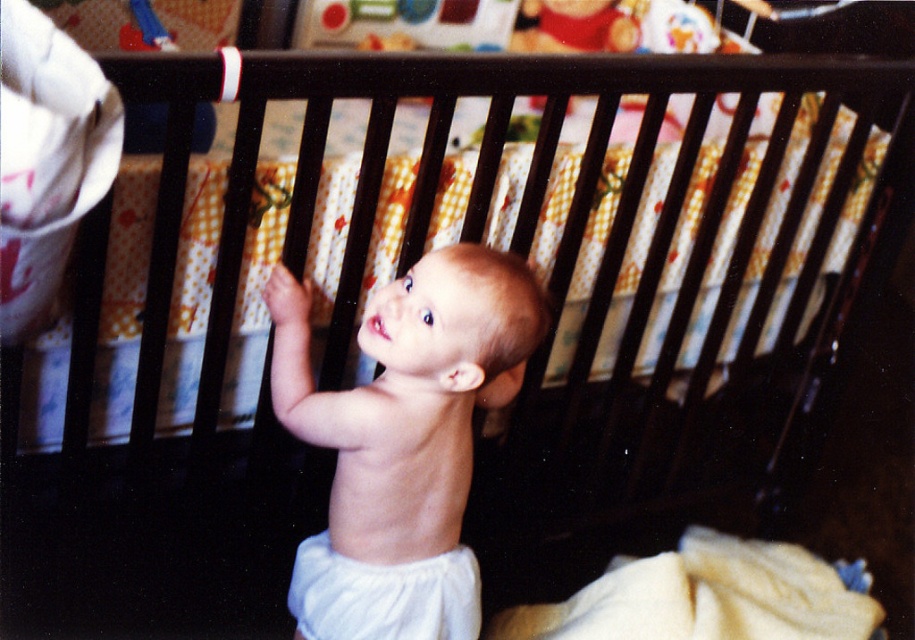
Question: Which point appears closest to the camera in this image?

Choices:
 (A) (416, 580)
 (B) (300, 627)

Answer: (A)

Question: Does smooth white diaper at center appear on the right side of white cloth diaper at center?

Choices:
 (A) no
 (B) yes

Answer: (B)

Question: Can you confirm if smooth white diaper at center is positioned below white cloth diaper at center?

Choices:
 (A) yes
 (B) no

Answer: (B)

Question: Which point is farther from the camera taking this photo?

Choices:
 (A) (354, 609)
 (B) (501, 397)

Answer: (B)

Question: Is smooth white diaper at center to the left of white cloth diaper at center from the viewer's perspective?

Choices:
 (A) no
 (B) yes

Answer: (A)

Question: Which point is farther from the camera taking this photo?

Choices:
 (A) (429, 582)
 (B) (481, 348)

Answer: (A)